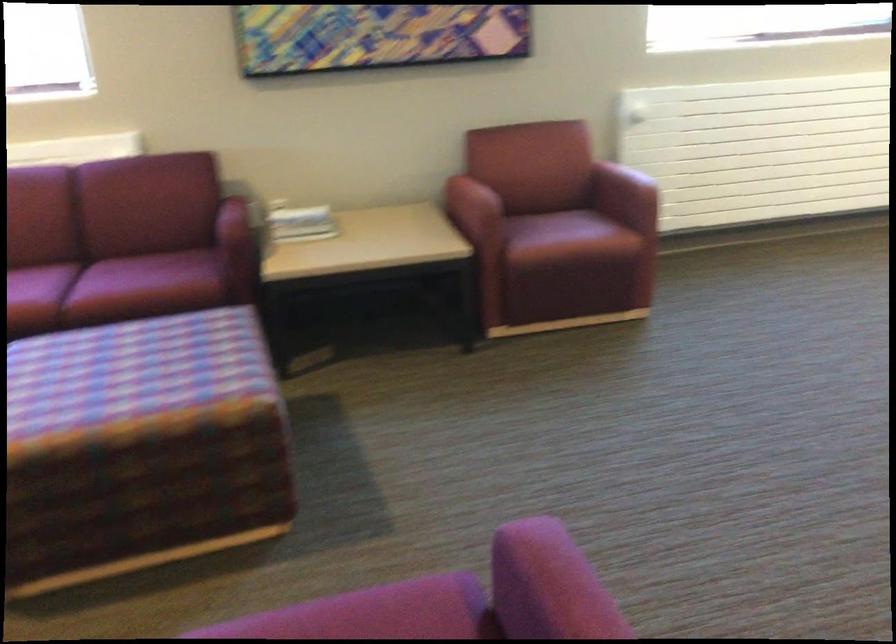
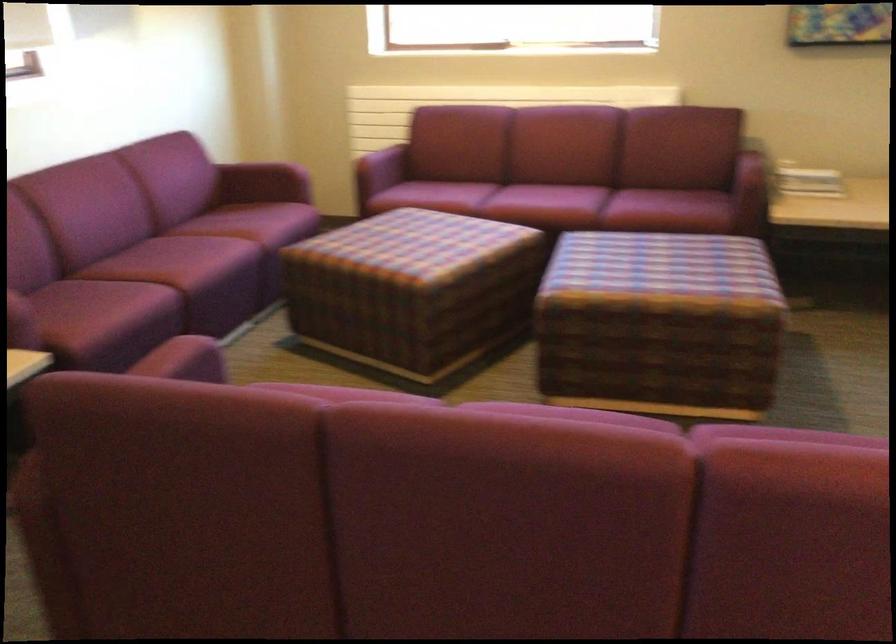
Find the pixel in the second image that matches (x=236, y=240) in the first image.

(753, 180)